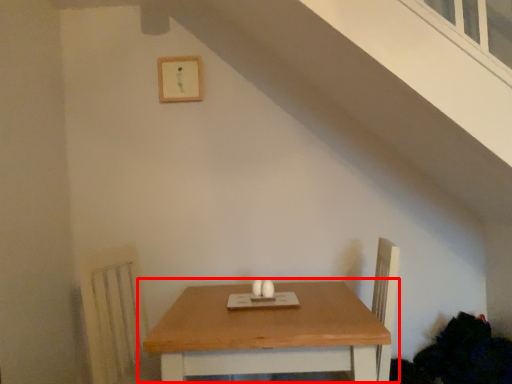
Question: From the image's perspective, considering the relative positions of table (annotated by the red box) and picture frame in the image provided, where is table (annotated by the red box) located with respect to the staircase?

Choices:
 (A) above
 (B) below

Answer: (B)